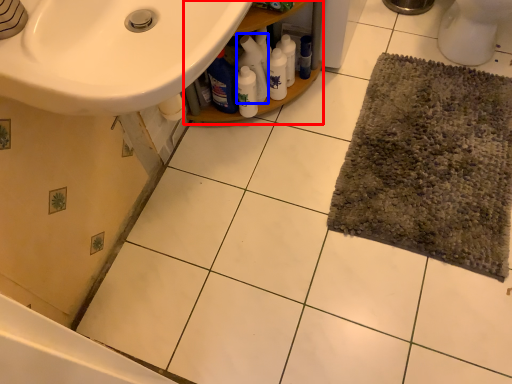
Question: Which object appears farthest to the camera in this image, balustrade (highlighted by a red box) or cleaning product (highlighted by a blue box)?

Choices:
 (A) balustrade
 (B) cleaning product

Answer: (B)